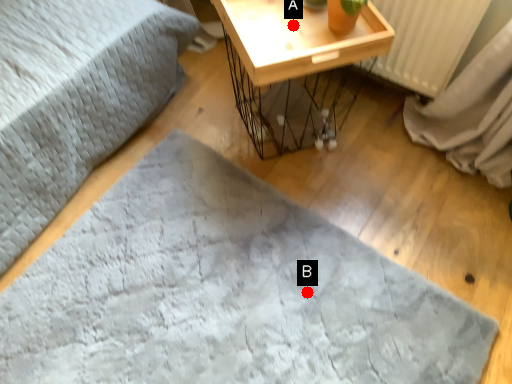
Question: Two points are circled on the image, labeled by A and B beside each circle. Which point appears farthest from the camera in this image?

Choices:
 (A) A is further
 (B) B is further

Answer: (A)